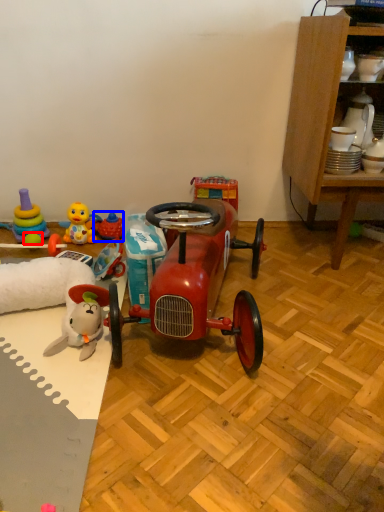
Question: Which object appears farthest to the camera in this image, toy (highlighted by a red box) or toy (highlighted by a blue box)?

Choices:
 (A) toy
 (B) toy

Answer: (B)